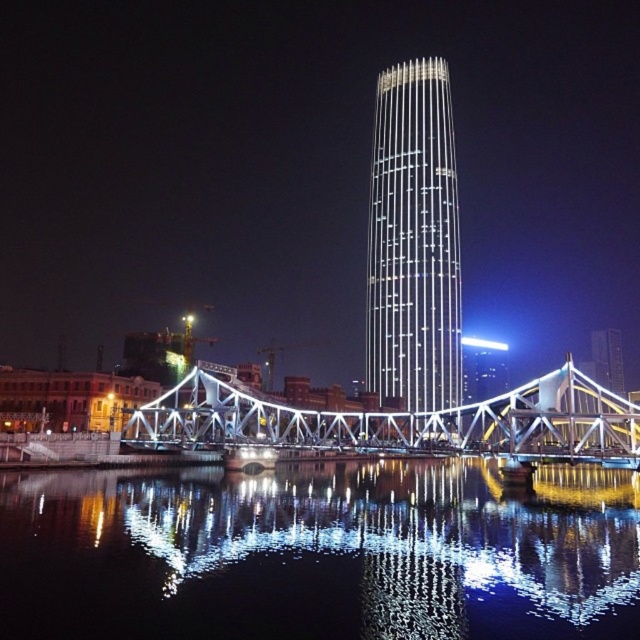
Question: Which object appears farthest from the camera in this image?

Choices:
 (A) black reflective water at center
 (B) shiny glass tower at center

Answer: (B)

Question: Can you confirm if black reflective water at center is wider than metallic bridge at center?

Choices:
 (A) no
 (B) yes

Answer: (B)

Question: Which point appears closest to the camera in this image?

Choices:
 (A) (403, 579)
 (B) (376, 276)

Answer: (A)

Question: Does shiny glass tower at center have a lesser width compared to metallic bridge at center?

Choices:
 (A) yes
 (B) no

Answer: (A)

Question: Which of these objects is positioned farthest from the shiny glass tower at center?

Choices:
 (A) black reflective water at center
 (B) metallic bridge at center

Answer: (A)

Question: Can you confirm if black reflective water at center is smaller than metallic bridge at center?

Choices:
 (A) yes
 (B) no

Answer: (A)